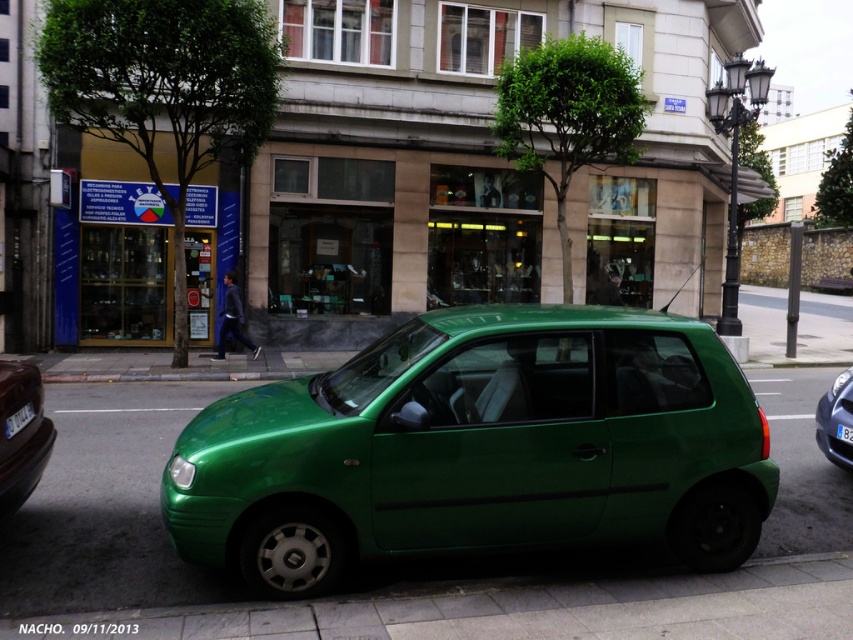
You are a delivery driver who needs to park your van in this street. You see the green matte hatchback at right and the white plastic license plate at lower left. Which object is closer to the curb?

The white plastic license plate at lower left is closer to the curb because the green matte hatchback at right is positioned on the right side of it, meaning the license plate is nearer to the edge of the road.

You are standing at the curb and want to cross the street to reach the shop. The green rubber pavement at center is the only safe crossing area. Can you step onto it without moving forward?

The green rubber pavement at center is 12.19 feet from viewer. Since it is 12.19 feet away, you would need to move forward to reach it and cannot step onto it without moving forward.

You are standing at the curb looking at the small green car parked there. There are two points marked on the car, one at coordinates point [720,404] and the other at point [851,436]. Which of these two points is closer to you?

Point [720,404] is closer to you because it is in front of point [851,436].